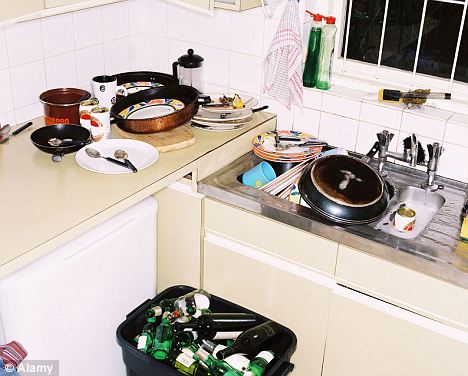
You are a GUI agent. You are given a task and a screenshot of the screen. Output one action in this format:
    pyautogui.click(x=<x>, y=<y>)
    Task: Click on the dish towel
    
    Given the screenshot: What is the action you would take?
    pyautogui.click(x=274, y=93)